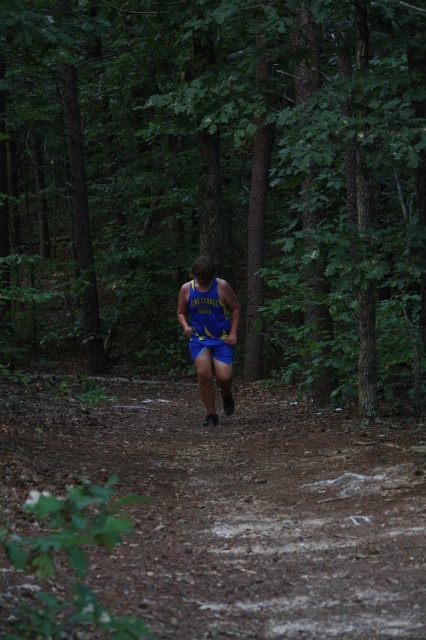
You are navigating through a dense forest in the evening. You see a point marked at coordinates (218,180). What is located at that point?

The point at coordinates (218,180) marks the green matte forest at center.

You are a hiker trying to navigate through the dense forest. You see the green matte forest at center and the brown dirt track at center. Which path is wider and better for walking?

The green matte forest at center is wider than the brown dirt track at center, so it is better for walking.

From the picture: You are a hiker navigating through the forest and notice the blue fabric shorts at center and the yellow jersey at center. Which item is nearer to you as you look at them?

The blue fabric shorts at center are closer to the viewer than the yellow jersey at center, so the blue fabric shorts at center is nearer to you.